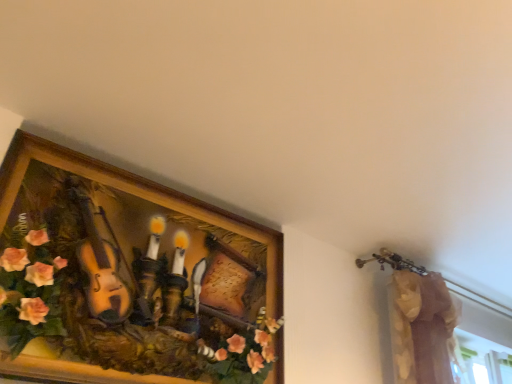
What is the approximate width of wooden picture frame at upper left?

The width of wooden picture frame at upper left is 6.00 inches.

What do you see at coordinates (127, 265) in the screenshot?
I see `wooden picture frame at upper left` at bounding box center [127, 265].

You are a GUI agent. You are given a task and a screenshot of the screen. Output one action in this format:
    pyautogui.click(x=<x>, y=<y>)
    Task: Click on the wooden picture frame at upper left
    
    Given the screenshot: What is the action you would take?
    pyautogui.click(x=127, y=265)

Find the location of a particular element. wooden picture frame at upper left is located at coordinates (127, 265).